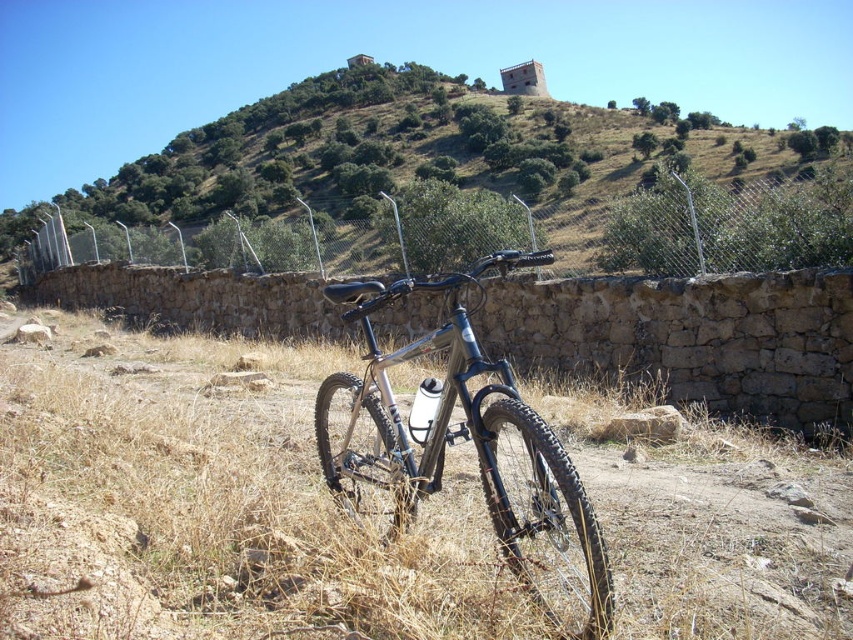
Question: Observing the image, what is the correct spatial positioning of green grassy hillside at center in reference to wire mesh fence at center?

Choices:
 (A) left
 (B) right

Answer: (A)

Question: Which object is the closest to the dry grass at center?

Choices:
 (A) shiny metallic bicycle at center
 (B) wire mesh fence at center
 (C) green grassy hillside at center

Answer: (A)

Question: Is dry grass at center thinner than shiny metallic bicycle at center?

Choices:
 (A) yes
 (B) no

Answer: (B)

Question: Can you confirm if wire mesh fence at center is positioned below shiny metallic bicycle at center?

Choices:
 (A) yes
 (B) no

Answer: (B)

Question: Which is farther from the shiny metallic bicycle at center?

Choices:
 (A) wire mesh fence at center
 (B) dry grass at center

Answer: (A)

Question: Estimate the real-world distances between objects in this image. Which object is closer to the shiny metallic bicycle at center?

Choices:
 (A) dry grass at center
 (B) wire mesh fence at center

Answer: (A)